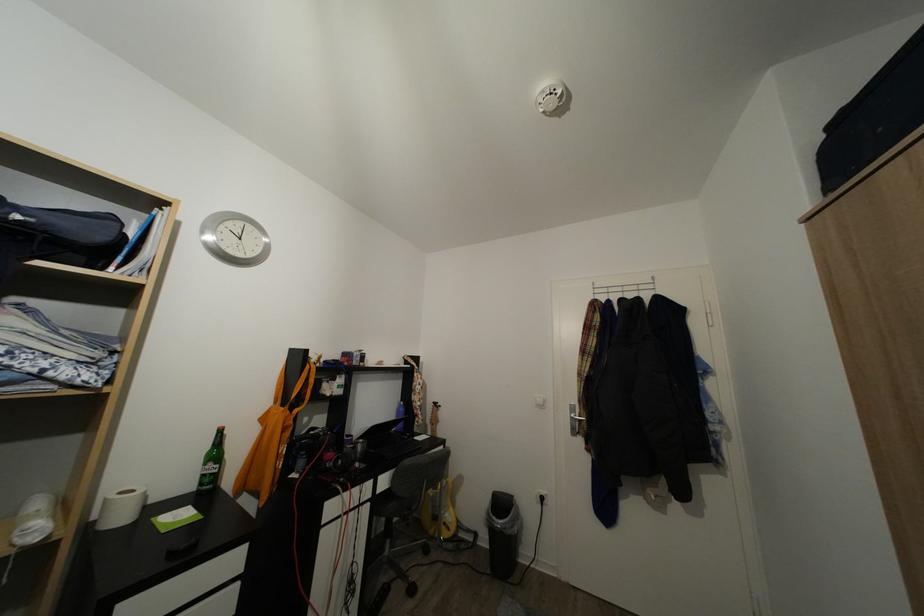
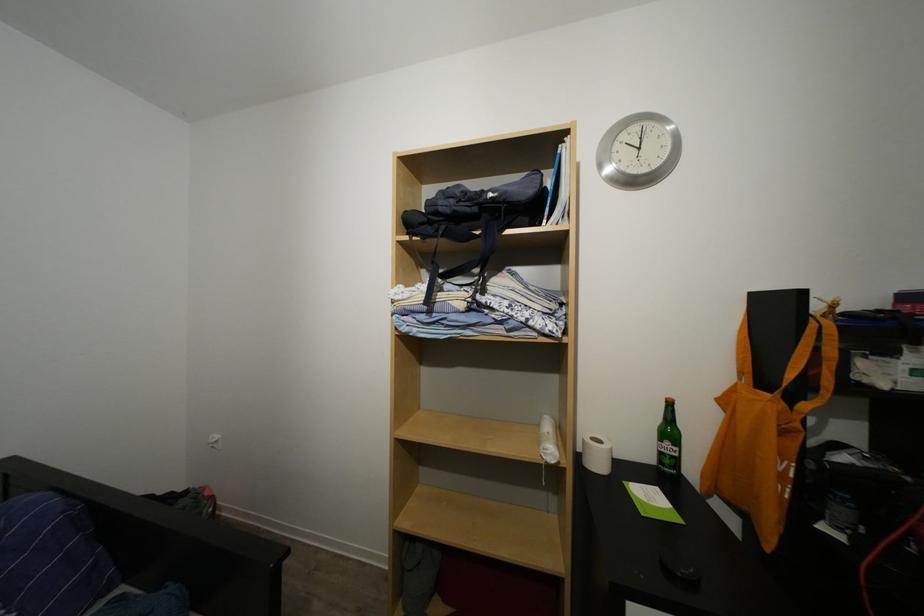
Find the pixel in the second image that matches pixel 217 471 in the first image.

(675, 450)